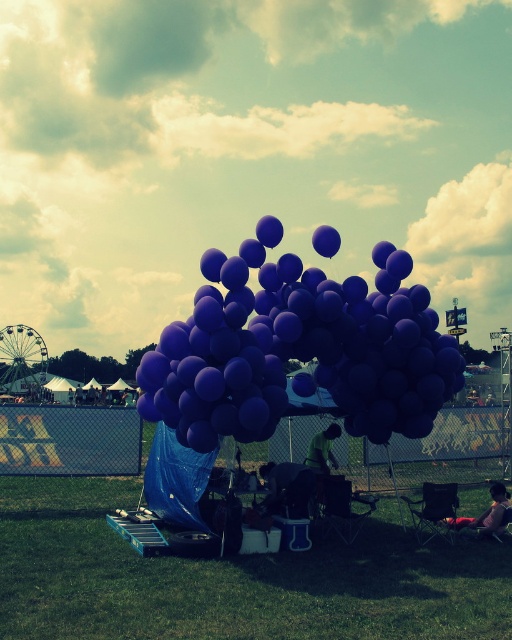
You are standing at the center of the scene. Which direction should you move to locate the matte pink shirt at lower right?

You should move towards the lower right direction to locate the matte pink shirt at lower right since it is positioned at point [486,513] which is in the lower right area of the scene.

You are a photographer standing at the edge of the scene and want to capture both the green grass at lower center and the matte purple balloons at center in a single shot. Given that your camera has a maximum focus range of 3 meters, will you be able to include both in focus without moving your position?

The green grass at lower center and matte purple balloons at center are 3.62 meters apart from each other. Since the distance between them exceeds the camera maximum focus range of 3 meters, you will not be able to capture both in focus without moving your position.

You are organizing an outdoor event and need to decide which item to place under the shaded area to protect it from the sun. Based on the image, which item between the matte purple balloons at center and the green fabric at center would you choose and why?

The matte purple balloons at center are thinner than the green fabric at center, so the matte purple balloons at center should be placed under the shaded area to protect them from the sun since they are more fragile.